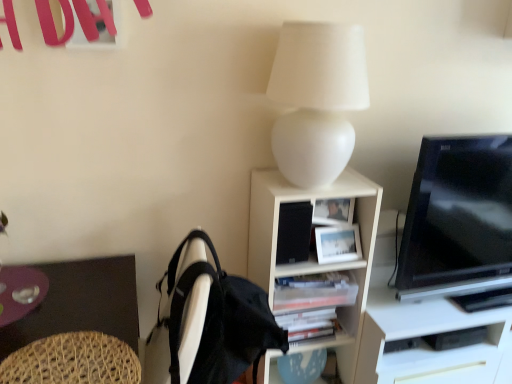
Where is `vacant space underneath black glossy tv at right (from a real-world perspective)`? This screenshot has height=384, width=512. vacant space underneath black glossy tv at right (from a real-world perspective) is located at coordinates (448, 307).